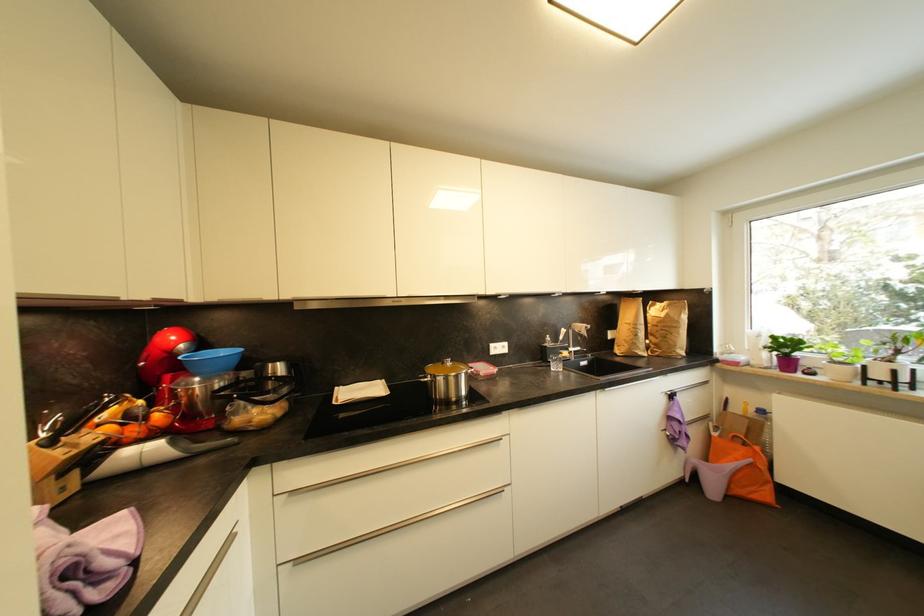
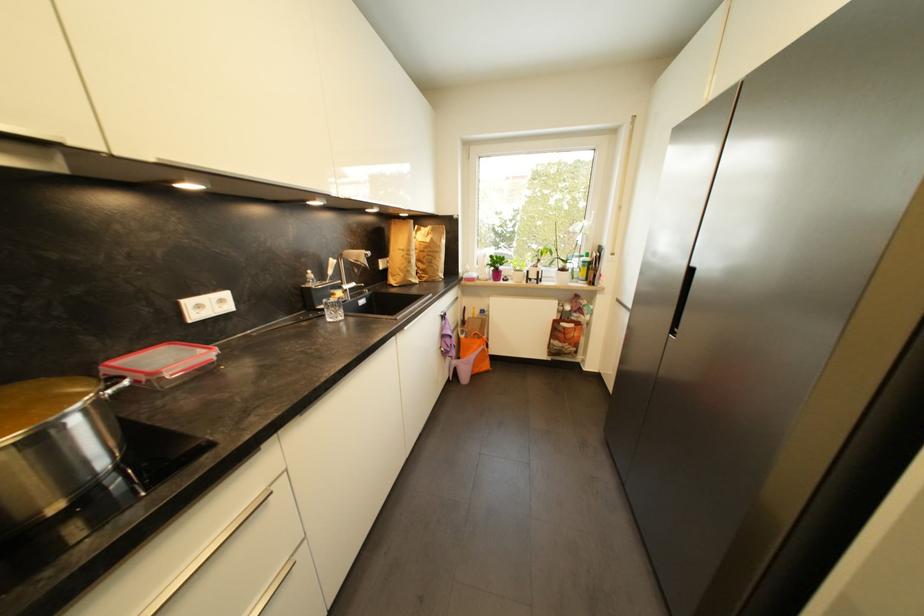
Locate, in the second image, the point that corresponds to (x=507, y=349) in the first image.

(226, 302)